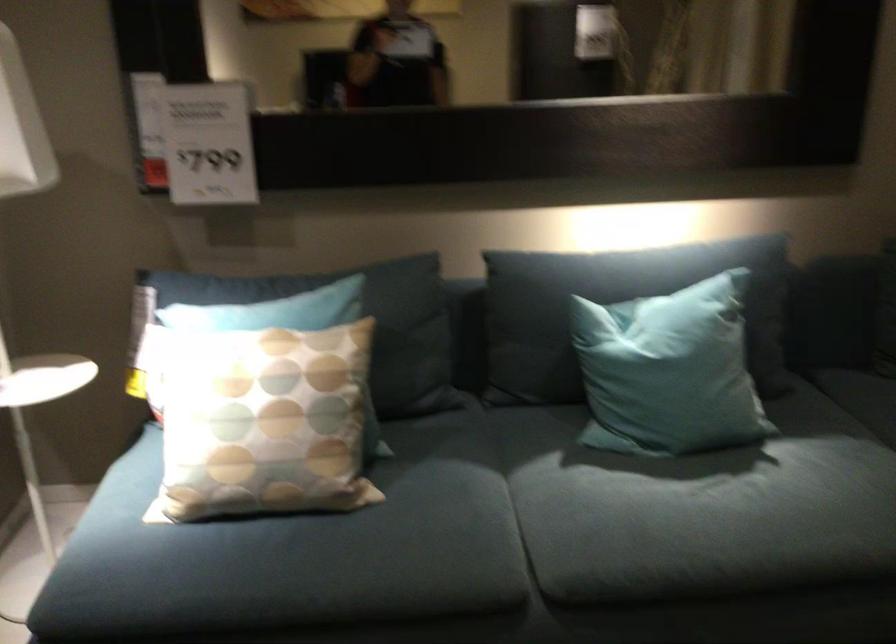
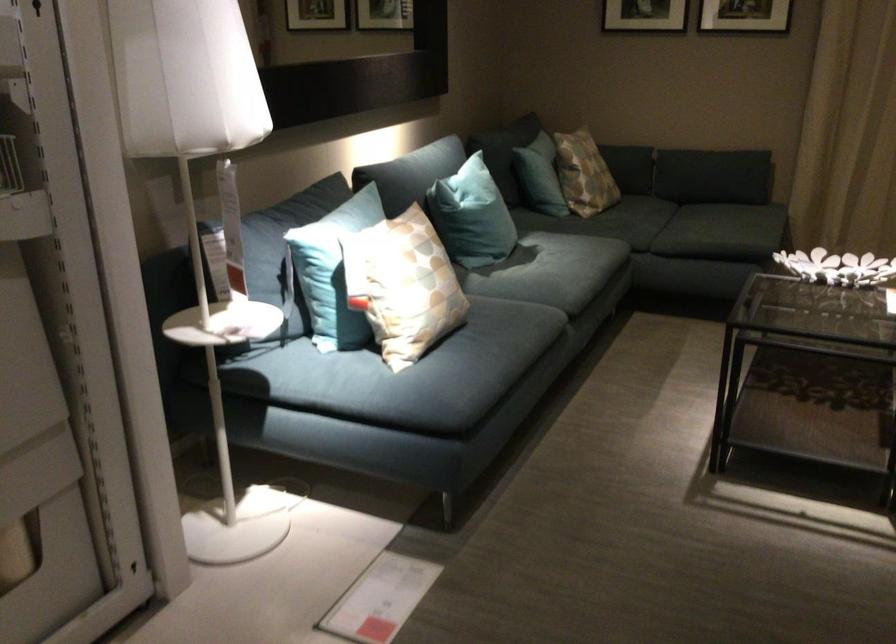
In the second image, find the point that corresponds to the point at 592,518 in the first image.

(552, 275)